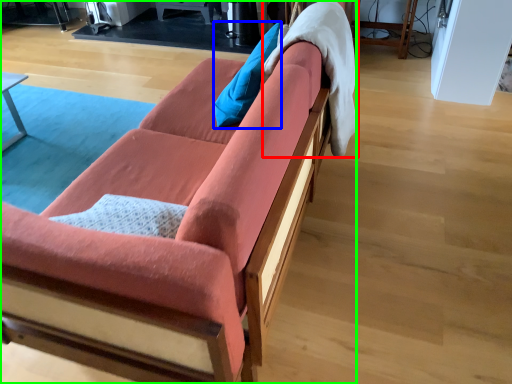
Question: Which object is positioned farthest from blanket (highlighted by a red box)? Select from pillow (highlighted by a blue box) and studio couch (highlighted by a green box).

Choices:
 (A) pillow
 (B) studio couch

Answer: (B)